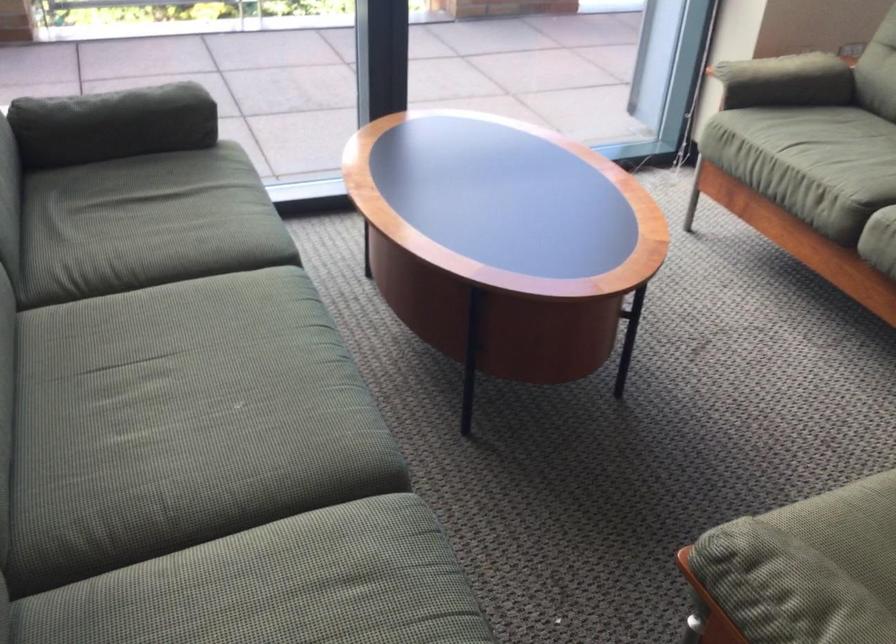
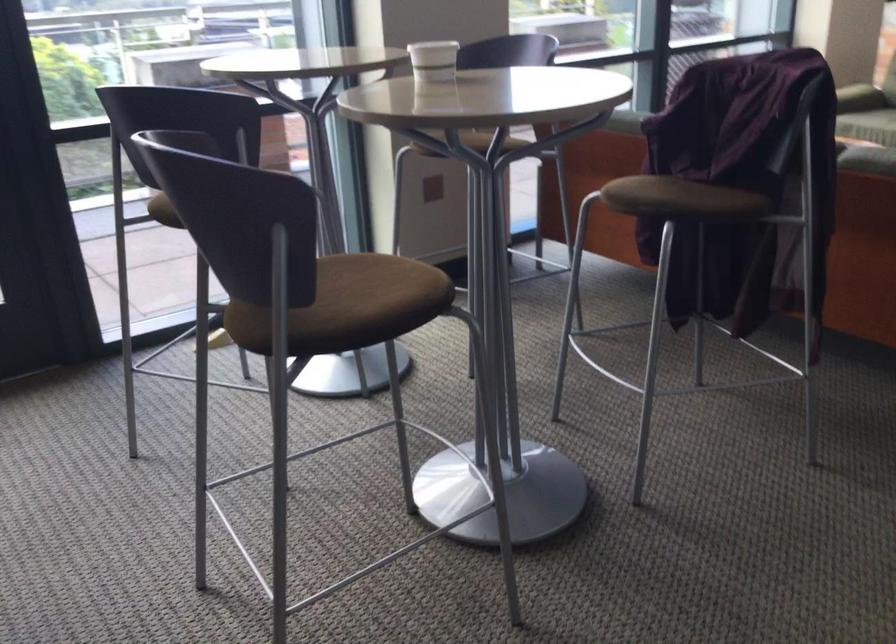
Question: I am providing you with two images of the same scene from different viewpoints. After the viewpoint changes to image2, which objects are now occluded?

Choices:
 (A) black bag on floor
 (B) white paper cup
 (C) green sofa armrest
 (D) brown chair sitting surface

Answer: (C)